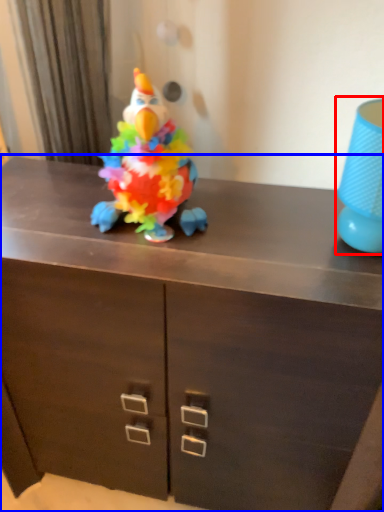
Question: Which point is closer to the camera, lamp (highlighted by a red box) or chest of drawers (highlighted by a blue box)?

Choices:
 (A) lamp
 (B) chest of drawers

Answer: (A)